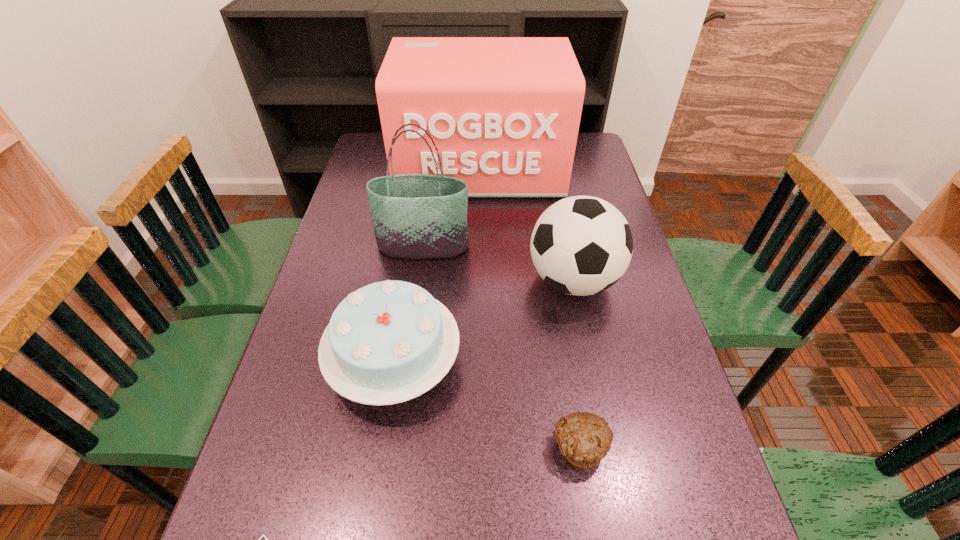
Locate an element on the screen. object that is at the far edge is located at coordinates pyautogui.click(x=504, y=112).

This screenshot has height=540, width=960. Find the location of `box present at the left edge`. box present at the left edge is located at coordinates (504, 112).

The width and height of the screenshot is (960, 540). What are the coordinates of `tote bag that is at the left edge` in the screenshot? It's located at (415, 216).

Find the location of a particular element. The width and height of the screenshot is (960, 540). birthday cake situated at the left edge is located at coordinates (388, 342).

Find the location of a particular element. The height and width of the screenshot is (540, 960). box that is at the right edge is located at coordinates (504, 112).

The height and width of the screenshot is (540, 960). Identify the location of soccer ball at the right edge. (581, 245).

I want to click on object situated at the far left corner, so (x=504, y=112).

The image size is (960, 540). Identify the location of object present at the far right corner. (504, 112).

In the image, there is a desktop. Where is `free space at the left edge`? free space at the left edge is located at coordinates (307, 310).

Where is `vacant area at the right edge`? This screenshot has width=960, height=540. vacant area at the right edge is located at coordinates (661, 341).